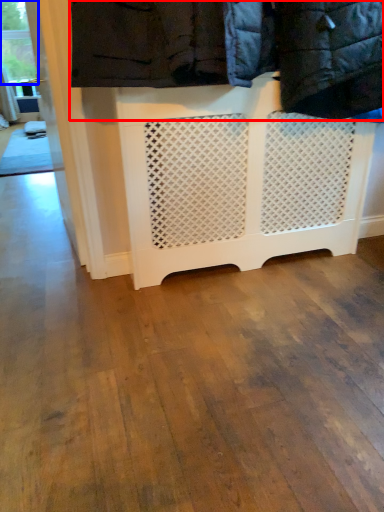
Question: Which point is further to the camera, laundry (highlighted by a red box) or window frame (highlighted by a blue box)?

Choices:
 (A) laundry
 (B) window frame

Answer: (B)